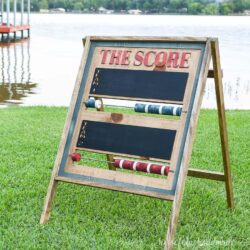
Locate an element on the screen. red adornments is located at coordinates (134, 165), (155, 169), (76, 158).